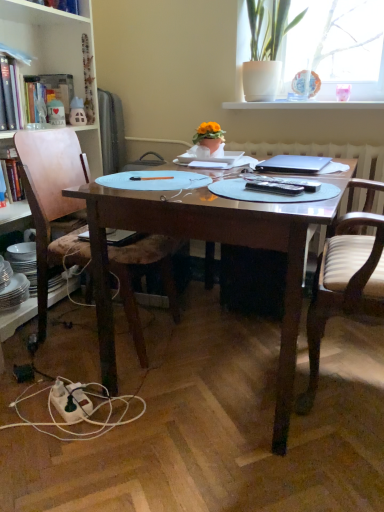
Where is `vacant region to the left of white plastic power outlet at lower left`? The height and width of the screenshot is (512, 384). vacant region to the left of white plastic power outlet at lower left is located at coordinates (27, 406).